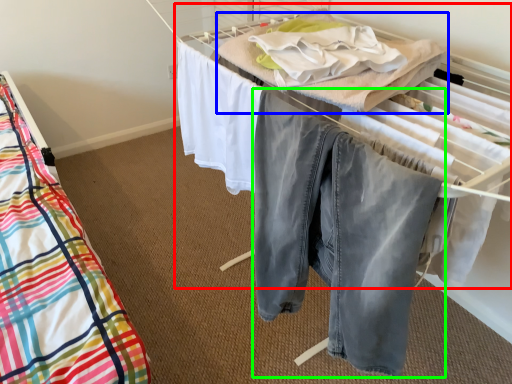
Question: Estimate the real-world distances between objects in this image. Which object is closer to bed (highlighted by a red box), blanket (highlighted by a blue box) or trousers (highlighted by a green box)?

Choices:
 (A) blanket
 (B) trousers

Answer: (A)